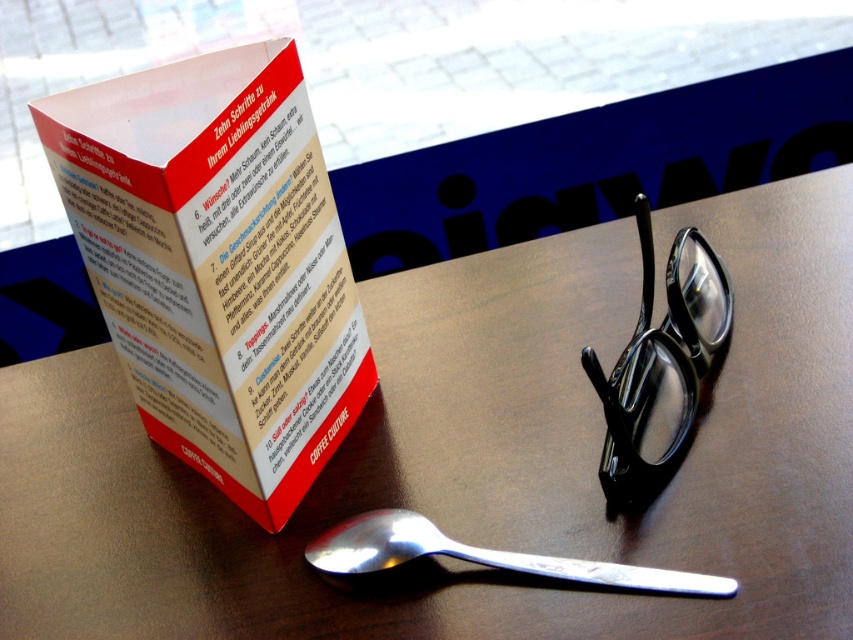
You are organizing a small event and need to place a decorative vase between the red paper brochure at upper center and the black shiny glasses at center. Based on their positions, where should you place the vase to ensure it is between them?

The vase should be placed to the right of the red paper brochure at upper center and to the left of the black shiny glasses at center since the red paper brochure at upper center is on the left side of the black shiny glasses at center.

You are a person sitting at the shiny brown table at center. You want to reach for the red paper brochure at upper center. Can you easily pick it up without moving your chair?

The shiny brown table at center is taller than the red paper brochure at upper center, so the brochure is lower and might be within easy reach. However, since tables are typically higher than the items on them, the brochure being lower suggests it is placed on the table surface. Therefore, you can easily pick it up without moving your chair.